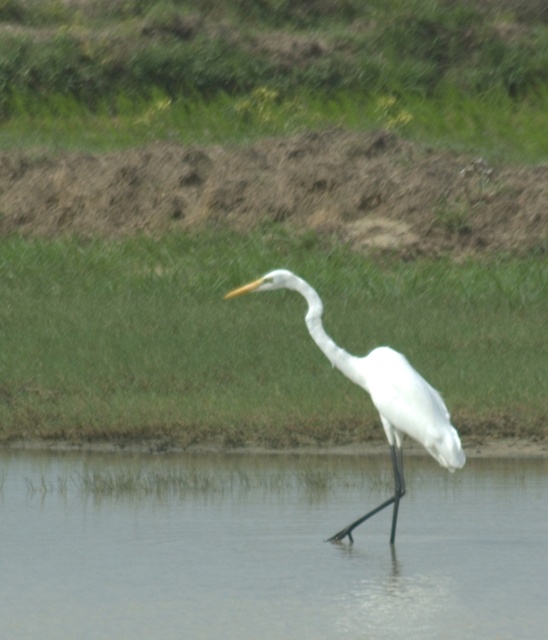
Question: Which point appears closest to the camera in this image?

Choices:
 (A) (389, 428)
 (B) (328, 348)

Answer: (B)

Question: Does clear water at center appear on the right side of white matte neck at center?

Choices:
 (A) yes
 (B) no

Answer: (B)

Question: Which object appears farthest from the camera in this image?

Choices:
 (A) white matte bird at center
 (B) clear water at center
 (C) white matte neck at center

Answer: (B)

Question: Which object is closer to the camera taking this photo?

Choices:
 (A) white matte neck at center
 (B) white matte bird at center

Answer: (A)

Question: Is white matte bird at center positioned at the back of white matte neck at center?

Choices:
 (A) yes
 (B) no

Answer: (A)

Question: Can you confirm if clear water at center is positioned to the left of white matte bird at center?

Choices:
 (A) no
 (B) yes

Answer: (B)